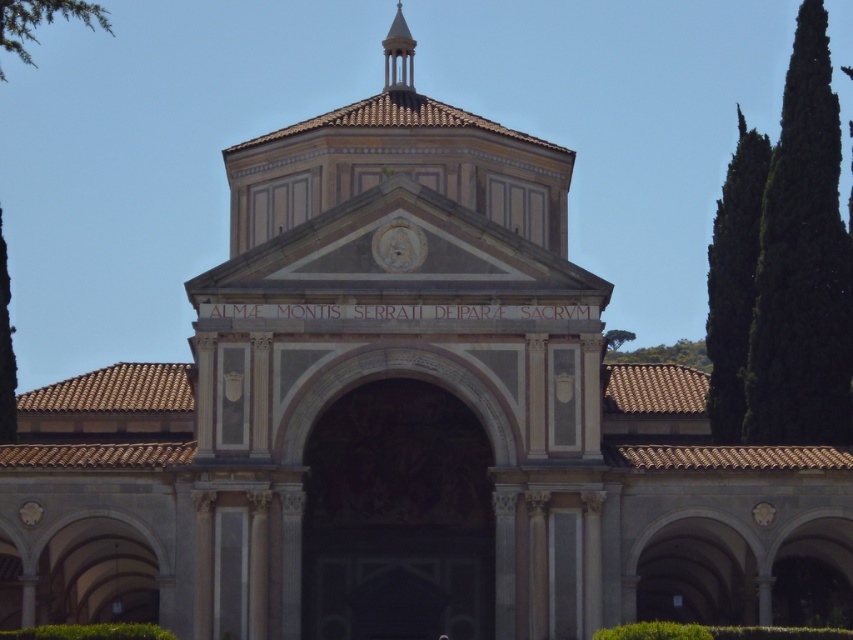
In the scene shown: You are standing at the base of the green leafy tree at right. You want to walk to the entrance of the church. How many steps do you need to take if each step covers 2.5 feet?

The distance between you and the entrance is 298.24 feet. Dividing this by 2.5 feet per step gives approximately 119.296 steps. Since you can only take whole steps, you would need to take 120 steps to reach the entrance.